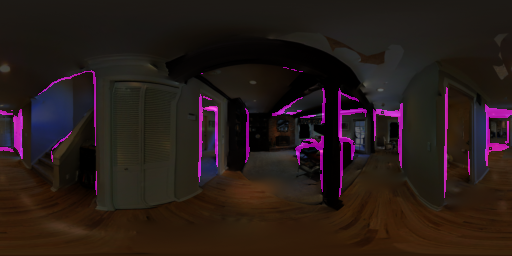
Locate an element on the screen. The width and height of the screenshot is (512, 256). ceiling is located at coordinates (361, 28).